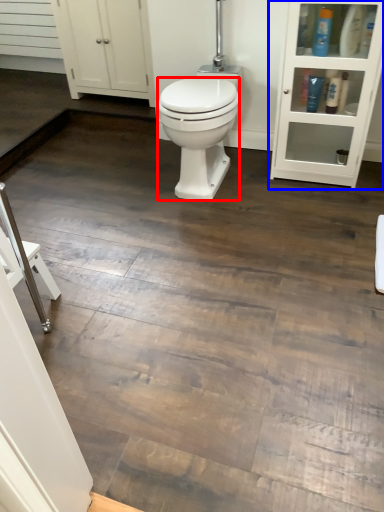
Question: Which point is further to the camera, bidet (highlighted by a red box) or shelf (highlighted by a blue box)?

Choices:
 (A) bidet
 (B) shelf

Answer: (A)